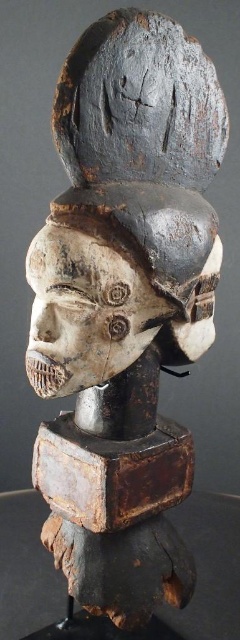
This screenshot has height=640, width=240. Describe the element at coordinates (120, 284) in the screenshot. I see `white carved wood mask at center` at that location.

Does white carved wood mask at center have a larger size compared to dark gray wood mask at upper center?

Yes, white carved wood mask at center is bigger than dark gray wood mask at upper center.

Between point (48, 244) and point (79, 109), which one is positioned behind?

Positioned behind is point (48, 244).

Where is `white carved wood mask at center`? This screenshot has width=240, height=640. white carved wood mask at center is located at coordinates (120, 284).